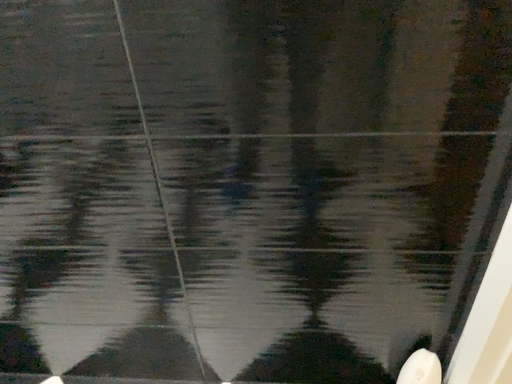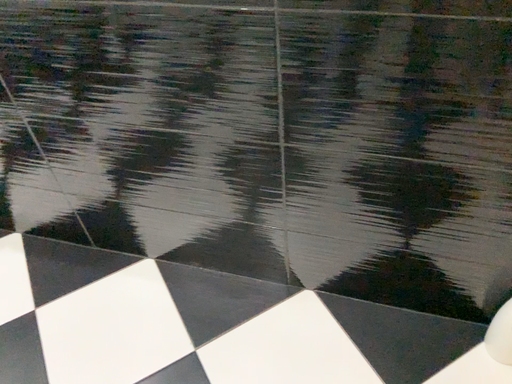
Question: How did the camera likely rotate when shooting the video?

Choices:
 (A) rotated downward
 (B) rotated upward

Answer: (A)